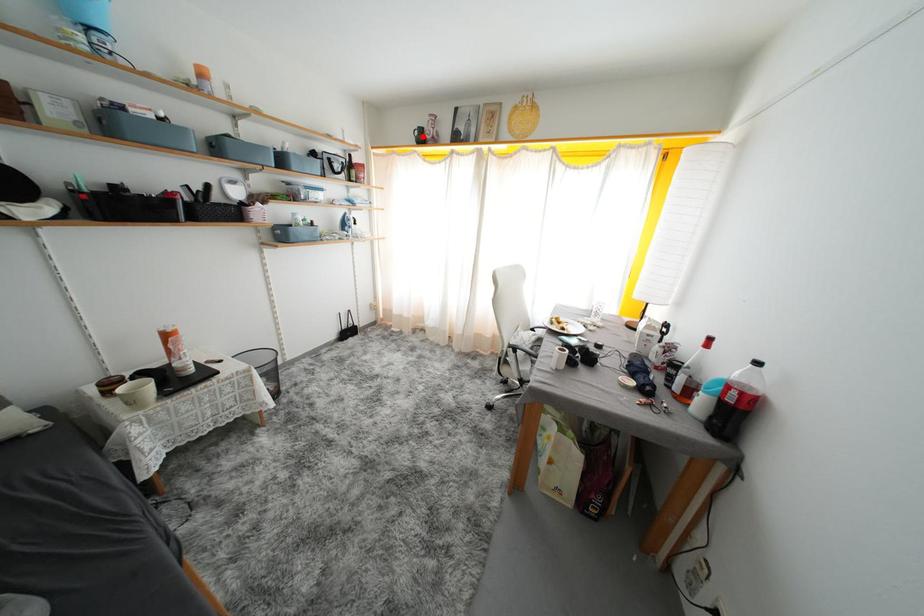
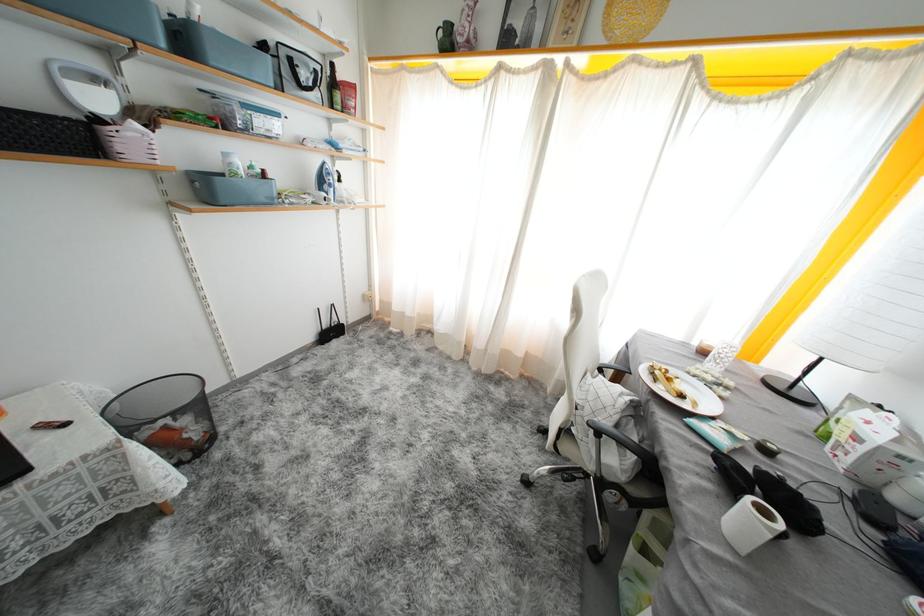
Question: I am providing you with two images of the same scene from different viewpoints. Given a red point in image1, look at the same physical point in image2. Is it:

Choices:
 (A) Closer to the viewpoint
 (B) Farther from the viewpoint

Answer: (B)